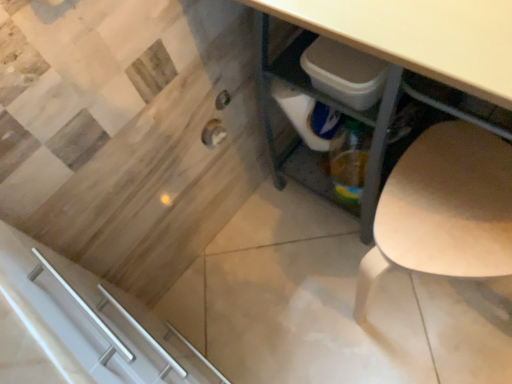
Question: Is light wood chair at lower right at the left side of matte white desk at center?

Choices:
 (A) yes
 (B) no

Answer: (B)

Question: From a real-world perspective, does light wood chair at lower right stand above matte white desk at center?

Choices:
 (A) no
 (B) yes

Answer: (A)

Question: Does light wood chair at lower right have a greater height compared to matte white desk at center?

Choices:
 (A) no
 (B) yes

Answer: (A)

Question: Can you confirm if light wood chair at lower right is bigger than matte white desk at center?

Choices:
 (A) no
 (B) yes

Answer: (A)

Question: Is light wood chair at lower right smaller than matte white desk at center?

Choices:
 (A) no
 (B) yes

Answer: (B)

Question: From the image's perspective, is light wood chair at lower right below matte white desk at center?

Choices:
 (A) no
 (B) yes

Answer: (B)

Question: Considering the relative sizes of matte white desk at center and light wood chair at lower right in the image provided, is matte white desk at center wider than light wood chair at lower right?

Choices:
 (A) yes
 (B) no

Answer: (A)

Question: From the image's perspective, is matte white desk at center over light wood chair at lower right?

Choices:
 (A) no
 (B) yes

Answer: (B)

Question: Is matte white desk at center taller than light wood chair at lower right?

Choices:
 (A) no
 (B) yes

Answer: (B)

Question: Is matte white desk at center behind light wood chair at lower right?

Choices:
 (A) no
 (B) yes

Answer: (A)

Question: Does matte white desk at center have a lesser height compared to light wood chair at lower right?

Choices:
 (A) no
 (B) yes

Answer: (A)

Question: Is matte white desk at center not within light wood chair at lower right?

Choices:
 (A) yes
 (B) no

Answer: (A)

Question: In the image, is light wood chair at lower right on the left side or the right side of matte white desk at center?

Choices:
 (A) left
 (B) right

Answer: (B)